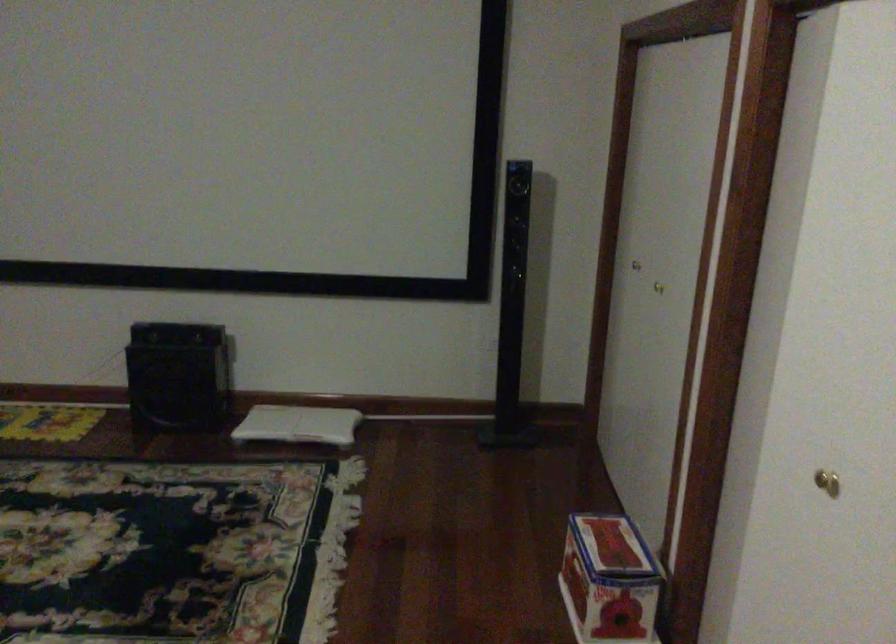
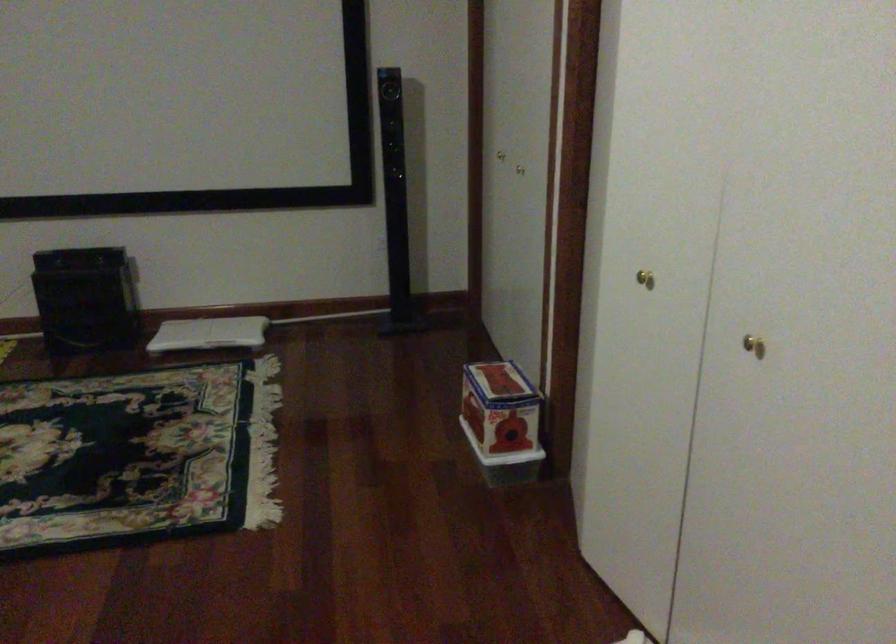
Question: What movement of the cameraman would produce the second image?

Choices:
 (A) Left
 (B) Right
 (C) Forward
 (D) Backward

Answer: (D)